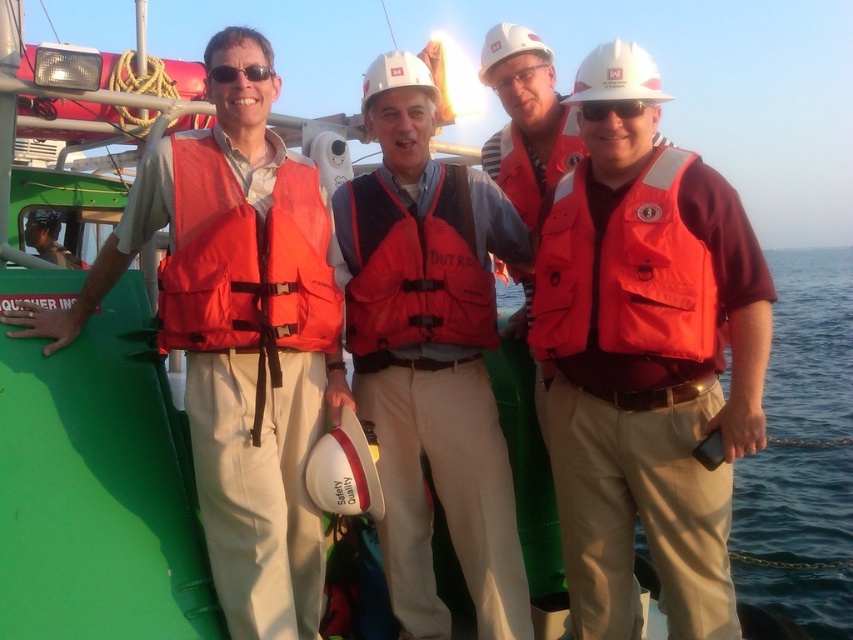
Is orange fabric life jacket at left above matte white goggles at center?

No, orange fabric life jacket at left is not above matte white goggles at center.

Which is more to the left, orange fabric life jacket at left or matte white goggles at center?

orange fabric life jacket at left

This screenshot has height=640, width=853. Describe the element at coordinates (245, 260) in the screenshot. I see `orange fabric life jacket at left` at that location.

Identify the location of orange fabric life jacket at left. The image size is (853, 640). (245, 260).

Measure the distance between matte orange life vest at left and matte orange life jacket at right.

matte orange life vest at left is 1.26 meters away from matte orange life jacket at right.

Can you confirm if matte orange life vest at left is taller than matte orange life jacket at right?

Yes.

This screenshot has height=640, width=853. What are the coordinates of `matte orange life vest at left` in the screenshot? It's located at (236, 342).

This screenshot has height=640, width=853. Identify the location of matte orange life vest at left. (236, 342).

Which is more to the left, orange fabric life vest at center or sunglasses at center?

From the viewer's perspective, sunglasses at center appears more on the left side.

Between point (727, 630) and point (242, 72), which one is positioned in front?

Point (727, 630) is more forward.

Locate an element on the screen. Image resolution: width=853 pixels, height=640 pixels. orange fabric life vest at center is located at coordinates (645, 358).